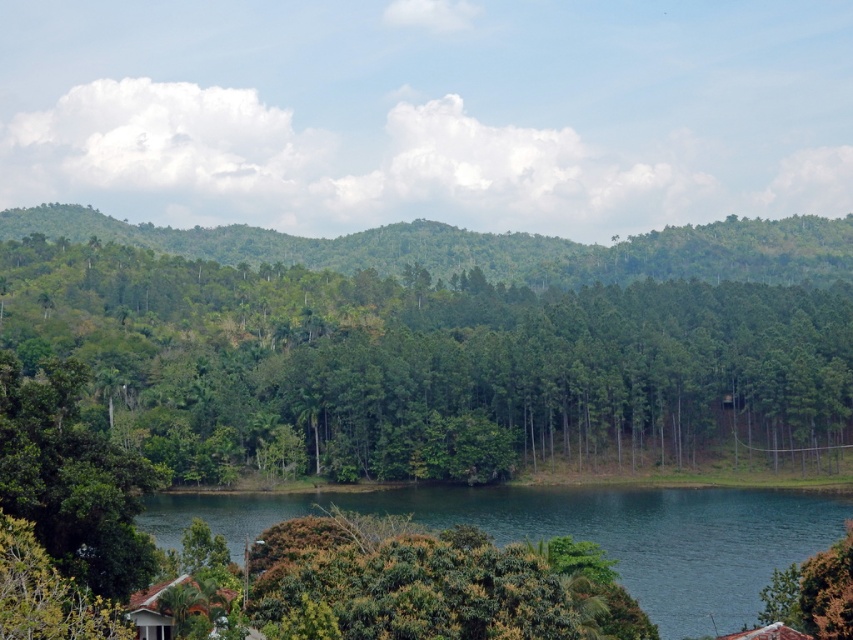
Question: Observing the image, what is the correct spatial positioning of green leafy hillside at center in reference to white shingled hut at lower left?

Choices:
 (A) above
 (B) below

Answer: (A)

Question: Is green leafy trees at center behind clear blue water at bottom?

Choices:
 (A) yes
 (B) no

Answer: (A)

Question: Which is nearer to the white shingled hut at lower left?

Choices:
 (A) green leafy trees at center
 (B) clear blue water at bottom

Answer: (B)

Question: Which object is the closest to the clear blue water at bottom?

Choices:
 (A) green leafy hillside at center
 (B) green leafy trees at center
 (C) white shingled hut at lower left

Answer: (C)

Question: Can you confirm if green leafy trees at center is positioned to the right of clear blue water at bottom?

Choices:
 (A) yes
 (B) no

Answer: (B)

Question: Which object is closer to the camera taking this photo?

Choices:
 (A) clear blue water at bottom
 (B) green leafy trees at center
 (C) green leafy hillside at center

Answer: (A)